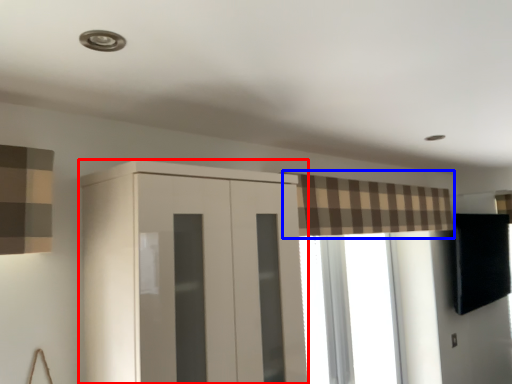
Question: Which point is further to the camera, cupboard (highlighted by a red box) or curtain (highlighted by a blue box)?

Choices:
 (A) cupboard
 (B) curtain

Answer: (B)